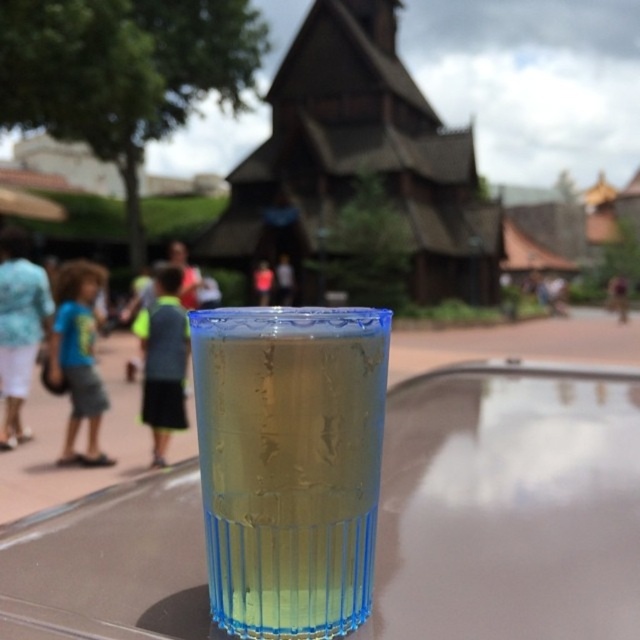
Question: Considering the relative positions of matte blue shirt at center and blue fabric shirt at center in the image provided, where is matte blue shirt at center located with respect to blue fabric shirt at center?

Choices:
 (A) right
 (B) left

Answer: (A)

Question: Among these points, which one is farthest from the camera?

Choices:
 (A) (284, 296)
 (B) (26, 376)
 (C) (157, 365)

Answer: (A)

Question: Which of the following is the closest to the observer?

Choices:
 (A) matte blue shorts at left
 (B) blue fabric shirt at center

Answer: (A)

Question: Based on their relative distances, which object is farther from the matte blue shorts at left?

Choices:
 (A) matte blue shirt at center
 (B) blue fabric shirt at center
 (C) gray fabric shorts at center
 (D) blue fabric shorts at left

Answer: (A)

Question: Considering the relative positions of translucent plastic cup at center and blue fabric shirt at center in the image provided, where is translucent plastic cup at center located with respect to blue fabric shirt at center?

Choices:
 (A) below
 (B) above

Answer: (A)

Question: Can you confirm if matte blue shorts at left is thinner than gray fabric shorts at center?

Choices:
 (A) no
 (B) yes

Answer: (A)